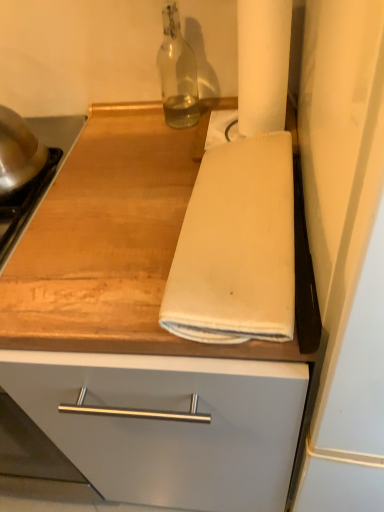
Where is `unoccupied region to the right of transparent glass bottle at upper center`? The height and width of the screenshot is (512, 384). unoccupied region to the right of transparent glass bottle at upper center is located at coordinates click(220, 113).